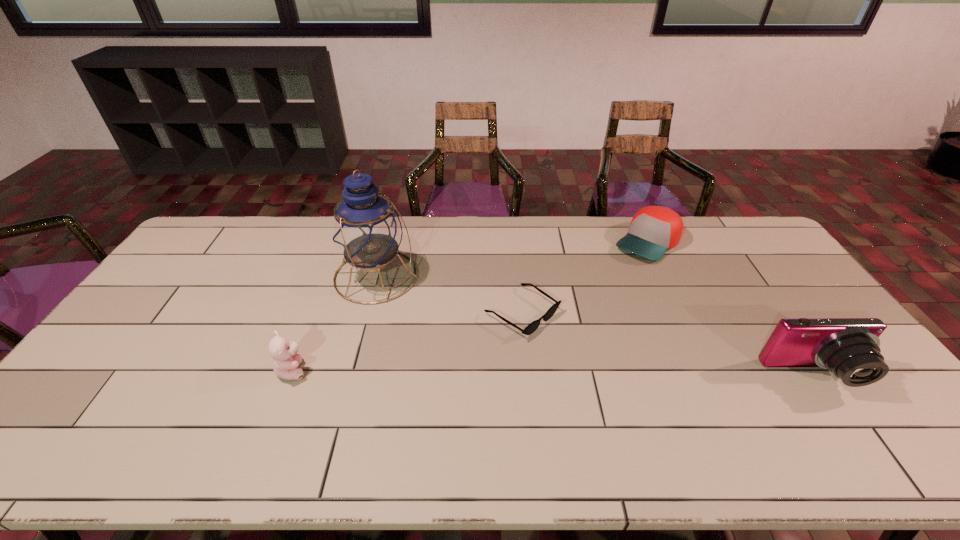
The width and height of the screenshot is (960, 540). In order to click on object that is at the right edge in this screenshot , I will do `click(849, 347)`.

Find the location of a particular element. This screenshot has width=960, height=540. object positioned at the near right corner is located at coordinates (849, 347).

This screenshot has width=960, height=540. In order to click on blank space at the far edge of the desktop in this screenshot , I will do `click(264, 242)`.

You are a GUI agent. You are given a task and a screenshot of the screen. Output one action in this format:
    pyautogui.click(x=<x>, y=<y>)
    Task: Click on the vacant space at the near edge
    The image size is (960, 540).
    Given the screenshot: What is the action you would take?
    pyautogui.click(x=789, y=413)

The width and height of the screenshot is (960, 540). In the image, there is a desktop. What are the coordinates of `vacant area at the left edge` in the screenshot? It's located at (198, 269).

In the image, there is a desktop. Where is `blank space at the near left corner`? This screenshot has height=540, width=960. blank space at the near left corner is located at coordinates click(x=99, y=395).

In the image, there is a desktop. Identify the location of vacant space at the far right corner. The height and width of the screenshot is (540, 960). (739, 247).

The image size is (960, 540). I want to click on free space at the near right corner of the desktop, so click(848, 416).

Locate an element on the screen. vacant area between the teddy bear and the tallest object is located at coordinates (335, 323).

The width and height of the screenshot is (960, 540). Identify the location of free area in between the rightmost object and the teddy bear. (553, 373).